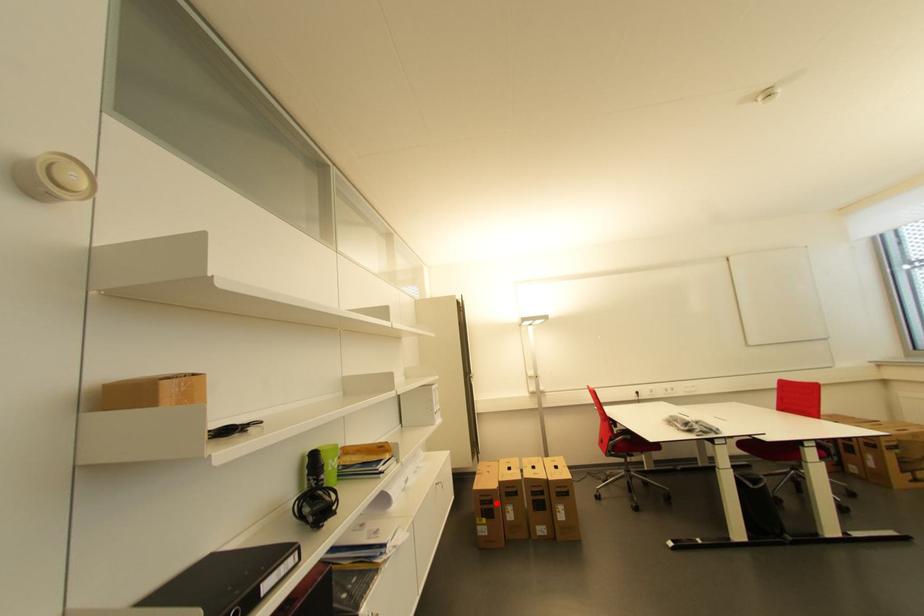
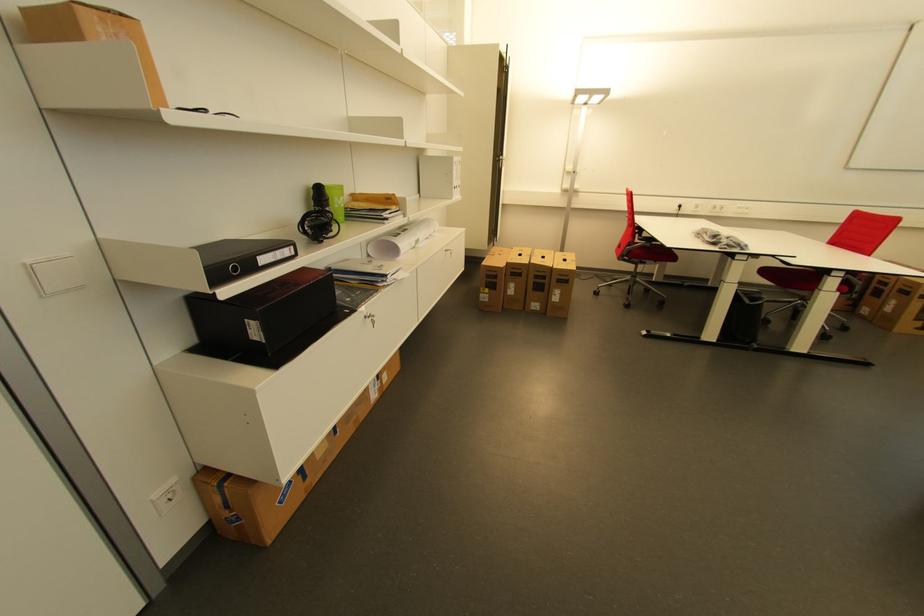
Locate, in the second image, the point that corresponds to the highlighted location in the first image.

(502, 278)